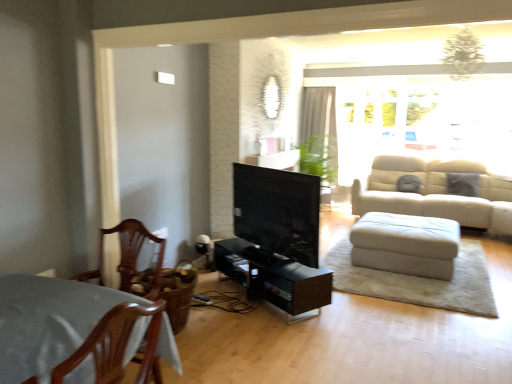
Locate an element on the screen. The image size is (512, 384). black glossy entertainment center at center is located at coordinates (276, 240).

In order to face translucent glass window at upper right, should I rotate leftwards or rightwards?

It's best to rotate right around 21.022 degrees.

In order to face mahogany wood chair at left, should I rotate leftwards or rightwards?

You should look left and rotate roughly 20.197 degrees.

Find the location of `white sheer curtain at upper center`. white sheer curtain at upper center is located at coordinates (x=318, y=133).

I want to click on matte black tv at center, so click(x=278, y=211).

Is matte black tv at center wider than black glossy entertainment center at center?

No.

Consider the image. Is black glossy entertainment center at center at the back of matte black tv at center?

No, black glossy entertainment center at center is not at the back of matte black tv at center.

How different are the orientations of matte black tv at center and black glossy entertainment center at center in degrees?

The angular difference between matte black tv at center and black glossy entertainment center at center is 0.284 degrees.

From the image's perspective, does matte black tv at center appear lower than black glossy entertainment center at center?

Incorrect, from the image's perspective, matte black tv at center is higher than black glossy entertainment center at center.

Is mahogany wood chair at left far from black glossy entertainment center at center?

Absolutely, mahogany wood chair at left is distant from black glossy entertainment center at center.

The height and width of the screenshot is (384, 512). I want to click on entertainment center behind the mahogany wood chair at left, so click(276, 240).

Is mahogany wood chair at left outside of black glossy entertainment center at center?

mahogany wood chair at left lies outside black glossy entertainment center at center's area.

From the image's perspective, between mahogany wood chair at left and white leather footrest at lower right, which one is located above?

white leather footrest at lower right appears higher in the image.

Is mahogany wood chair at left at the left side of white leather footrest at lower right?

Indeed, mahogany wood chair at left is positioned on the left side of white leather footrest at lower right.

Which is in front, mahogany wood chair at left or white leather footrest at lower right?

Positioned in front is mahogany wood chair at left.

From a real-world perspective, which object stands above the other?

mahogany wood chair at left, from a real-world perspective.

Which of these two, mahogany wood chair at left or translucent glass window at upper right, stands shorter?

mahogany wood chair at left.

Could you tell me if mahogany wood chair at left is turned towards translucent glass window at upper right?

No, mahogany wood chair at left is not aimed at translucent glass window at upper right.

Who is bigger, mahogany wood chair at left or translucent glass window at upper right?

With larger size is translucent glass window at upper right.

Based on the photo, does mahogany wood chair at left contain translucent glass window at upper right?

That's incorrect, translucent glass window at upper right is not inside mahogany wood chair at left.

Is black glossy entertainment center at center oriented away from mahogany wood chair at left?

black glossy entertainment center at center is not turned away from mahogany wood chair at left.

Between black glossy entertainment center at center and mahogany wood chair at left, which one is positioned behind?

black glossy entertainment center at center is further away from the camera.

Considering the relative sizes of black glossy entertainment center at center and mahogany wood chair at left in the image provided, is black glossy entertainment center at center wider than mahogany wood chair at left?

Correct, the width of black glossy entertainment center at center exceeds that of mahogany wood chair at left.

You are a GUI agent. You are given a task and a screenshot of the screen. Output one action in this format:
    pyautogui.click(x=<x>, y=<y>)
    Task: Click on the chair above the black glossy entertainment center at center (from a real-world perspective)
    
    Given the screenshot: What is the action you would take?
    tap(129, 258)

Is white sheer curtain at upper center far from translucent glass window at upper right?

That's not correct — white sheer curtain at upper center is a little close to translucent glass window at upper right.

Considering the positions of objects white sheer curtain at upper center and translucent glass window at upper right in the image provided, who is in front, white sheer curtain at upper center or translucent glass window at upper right?

translucent glass window at upper right is closer to the camera.

Choose the correct answer: Is white sheer curtain at upper center inside translucent glass window at upper right or outside it?

white sheer curtain at upper center is spatially situated outside translucent glass window at upper right.

Considering the sizes of white sheer curtain at upper center and translucent glass window at upper right in the image, is white sheer curtain at upper center wider or thinner than translucent glass window at upper right?

In the image, white sheer curtain at upper center appears to be more narrow than translucent glass window at upper right.

In the scene shown: Is white leather footrest at lower right turned away from mahogany wood chair at left?

No.

Between white leather footrest at lower right and mahogany wood chair at left, which one has more height?

mahogany wood chair at left is taller.

From the image's perspective, does white leather footrest at lower right appear lower than mahogany wood chair at left?

Incorrect, from the image's perspective, white leather footrest at lower right is higher than mahogany wood chair at left.

This screenshot has height=384, width=512. I want to click on television that appears above the black glossy entertainment center at center (from a real-world perspective), so click(278, 211).

Where is `entertainment center below the mahogany wood chair at left (from the image's perspective)`? This screenshot has height=384, width=512. entertainment center below the mahogany wood chair at left (from the image's perspective) is located at coordinates (276, 240).

Based on their spatial positions, is matte black tv at center or mahogany wood chair at left closer to black glossy entertainment center at center?

matte black tv at center.

When comparing their distances from white leather footrest at lower right, does black glossy entertainment center at center or translucent glass window at upper right seem further?

translucent glass window at upper right lies further to white leather footrest at lower right than the other object.

Based on their spatial positions, is white sheer curtain at upper center or matte black tv at center further from mahogany wood chair at left?

white sheer curtain at upper center is positioned further to the anchor mahogany wood chair at left.

Which object lies nearer to the anchor point mahogany wood chair at left, white sheer curtain at upper center or black glossy entertainment center at center?

Based on the image, black glossy entertainment center at center appears to be nearer to mahogany wood chair at left.

Looking at the image, which one is located closer to mahogany wood chair at left, black glossy entertainment center at center or white leather footrest at lower right?

The object closer to mahogany wood chair at left is black glossy entertainment center at center.

Which object lies further to the anchor point white sheer curtain at upper center, translucent glass window at upper right or black glossy entertainment center at center?

Among the two, black glossy entertainment center at center is located further to white sheer curtain at upper center.

From the image, which object appears to be nearer to matte black tv at center, mahogany wood chair at left or white leather footrest at lower right?

Based on the image, mahogany wood chair at left appears to be nearer to matte black tv at center.

Consider the image. When comparing their distances from matte black tv at center, does black glossy entertainment center at center or white sheer curtain at upper center seem further?

white sheer curtain at upper center.

You are a GUI agent. You are given a task and a screenshot of the screen. Output one action in this format:
    pyautogui.click(x=<x>, y=<y>)
    Task: Click on the window positioned between mahogany wood chair at left and white sheer curtain at upper center from near to far
    This screenshot has height=384, width=512.
    Given the screenshot: What is the action you would take?
    pyautogui.click(x=419, y=113)

Locate an element on the screen. This screenshot has width=512, height=384. television between mahogany wood chair at left and white leather footrest at lower right is located at coordinates (278, 211).

Locate an element on the screen. This screenshot has width=512, height=384. entertainment center between mahogany wood chair at left and white leather footrest at lower right in the horizontal direction is located at coordinates (276, 240).

Where is `entertainment center located between mahogany wood chair at left and white sheer curtain at upper center in the depth direction`? This screenshot has width=512, height=384. entertainment center located between mahogany wood chair at left and white sheer curtain at upper center in the depth direction is located at coordinates (276, 240).